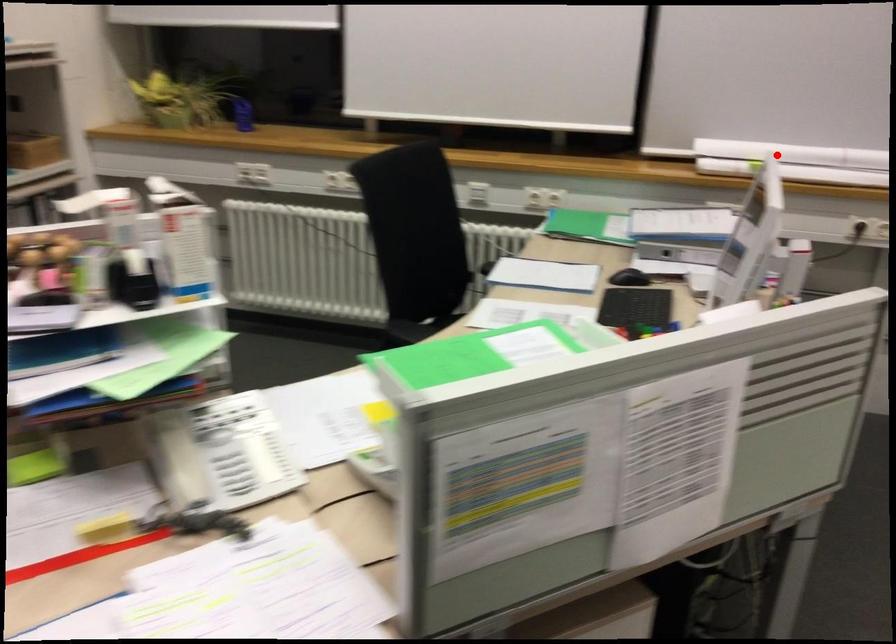
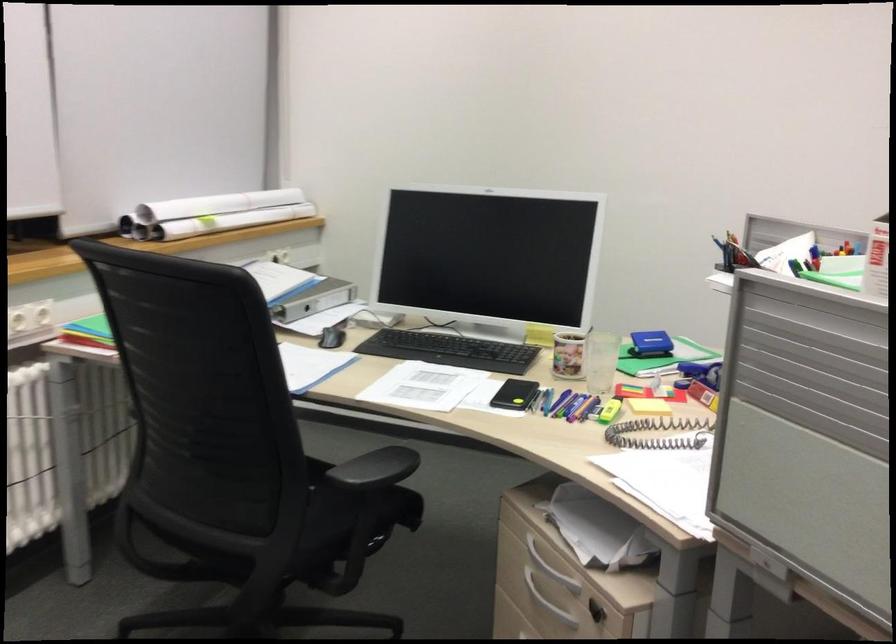
Find the pixel in the second image that matches the highlighted location in the first image.

(212, 214)